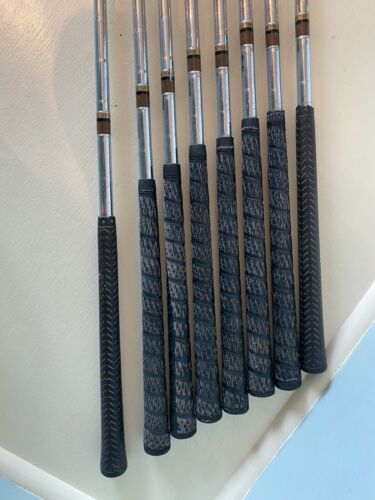
Find the location of a particular element. The image size is (375, 500). rod is located at coordinates (303, 47), (273, 70), (250, 74), (225, 79), (195, 86), (169, 95), (169, 393), (142, 127), (105, 165).